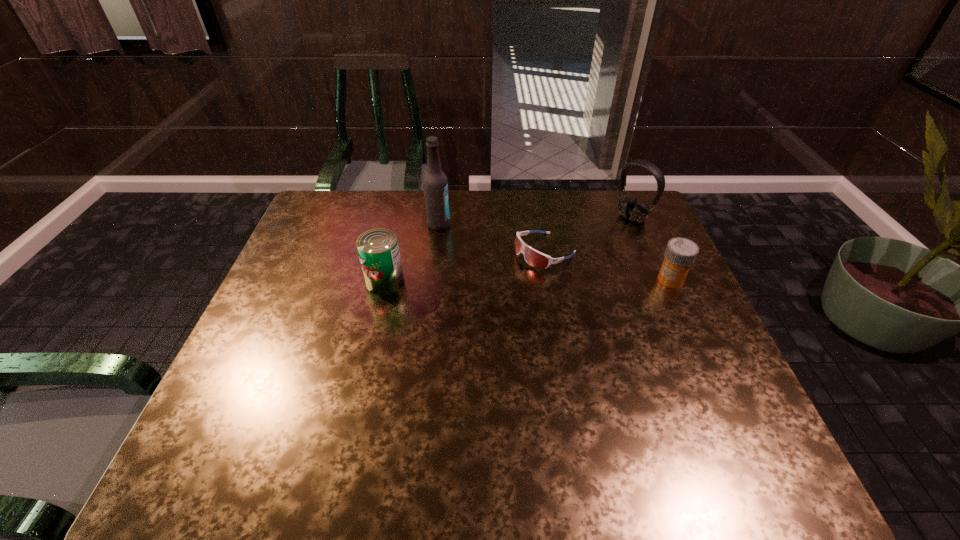
At what (x,y) coordinates should I click in order to perform the action: click on unoccupied area between the second object from left to right and the second shortest object. Please return your answer as a coordinate pair (x, y). The width and height of the screenshot is (960, 540). Looking at the image, I should click on (555, 252).

At what (x,y) coordinates should I click in order to perform the action: click on free area in between the third object from right to left and the fourth shortest object. Please return your answer as a coordinate pair (x, y). This screenshot has width=960, height=540. Looking at the image, I should click on (588, 235).

Locate an element on the screen. The width and height of the screenshot is (960, 540). object that is the second closest one to the shortest object is located at coordinates (435, 185).

I want to click on object that is the second closest to the headset, so click(x=680, y=254).

Find the location of a particular element. blank space that satisfies the following two spatial constraints: 1. on the front side of the shortest object; 2. on the right side of the beer bottle is located at coordinates (435, 252).

Locate an element on the screen. The width and height of the screenshot is (960, 540). vacant position in the image that satisfies the following two spatial constraints: 1. on the back side of the third object from left to right; 2. on the right side of the leftmost object is located at coordinates (392, 252).

Image resolution: width=960 pixels, height=540 pixels. Identify the location of blank area in the image that satisfies the following two spatial constraints: 1. on the front side of the third object from left to right; 2. on the label side of the fourth tallest object. (550, 279).